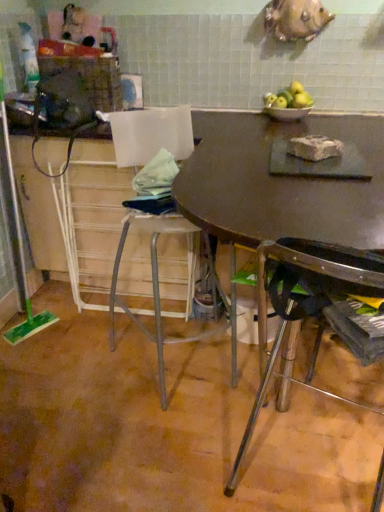
Question: Is white crumbly block at center not within green plastic screen door at left?

Choices:
 (A) yes
 (B) no

Answer: (A)

Question: Is green plastic screen door at left located within white crumbly block at center?

Choices:
 (A) no
 (B) yes

Answer: (A)

Question: Is white crumbly block at center to the right of green plastic screen door at left from the viewer's perspective?

Choices:
 (A) no
 (B) yes

Answer: (B)

Question: From a real-world perspective, is white crumbly block at center under green plastic screen door at left?

Choices:
 (A) yes
 (B) no

Answer: (B)

Question: From the image's perspective, is white crumbly block at center above green plastic screen door at left?

Choices:
 (A) yes
 (B) no

Answer: (A)

Question: From a real-world perspective, is white crumbly block at center positioned over green plastic screen door at left based on gravity?

Choices:
 (A) no
 (B) yes

Answer: (B)

Question: Can you confirm if metallic silver stool at center, marked as the first chair in a left-to-right arrangement, is bigger than matte brown table at center?

Choices:
 (A) yes
 (B) no

Answer: (B)

Question: Does metallic silver stool at center, marked as the first chair in a left-to-right arrangement, appear on the right side of matte brown table at center?

Choices:
 (A) no
 (B) yes

Answer: (A)

Question: From the image's perspective, is metallic silver stool at center, which ranks as the second chair in right-to-left order, over matte brown table at center?

Choices:
 (A) no
 (B) yes

Answer: (B)

Question: Is metallic silver stool at center, which ranks as the second chair in right-to-left order, surrounding matte brown table at center?

Choices:
 (A) yes
 (B) no

Answer: (B)

Question: Does metallic silver stool at center, which ranks as the second chair in right-to-left order, turn towards matte brown table at center?

Choices:
 (A) no
 (B) yes

Answer: (B)

Question: Is metallic silver stool at center, which ranks as the second chair in right-to-left order, facing away from matte brown table at center?

Choices:
 (A) yes
 (B) no

Answer: (A)

Question: From the image's perspective, is white crumbly block at center below metallic silver stool at center, marked as the first chair in a left-to-right arrangement?

Choices:
 (A) no
 (B) yes

Answer: (A)